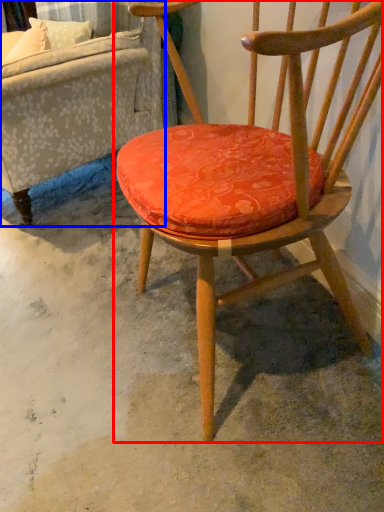
Question: Among these objects, which one is farthest to the camera, chair (highlighted by a red box) or studio couch (highlighted by a blue box)?

Choices:
 (A) chair
 (B) studio couch

Answer: (B)